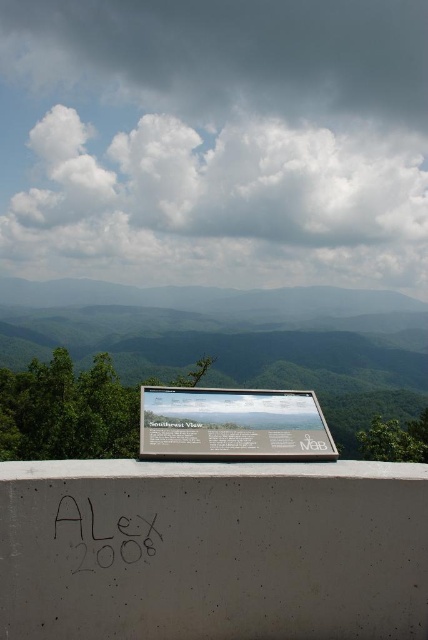
You are an artist trying to paint the scene. You want to ensure the white fluffy cloud at upper center and the black marker graffiti at center are proportionally accurate. Which object should you make wider in your painting?

The white fluffy cloud at upper center might be wider than the black marker graffiti at center, so you should make the white fluffy cloud at upper center wider in your painting.

You are standing at the overlook and want to take a photo of the white fluffy cloud at upper center. If your camera has a grid overlay that divides the frame into 9 equal parts, where would you position the cloud to follow the rule of thirds?

According to the rule of thirds, you should position the white fluffy cloud at upper center at the intersection point of the grid lines, which aligns with its current coordinates at point (219, 205). This placement enhances the visual appeal of the photo.